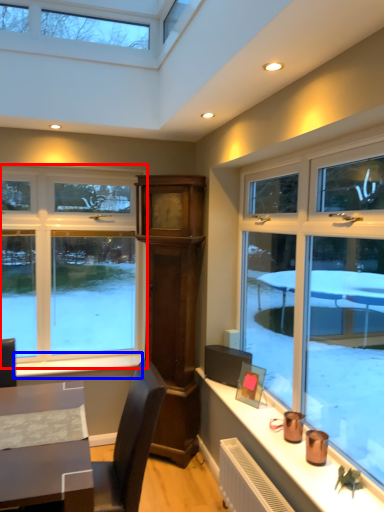
Question: Which object appears farthest to the camera in this image, window (highlighted by a red box) or window sill (highlighted by a blue box)?

Choices:
 (A) window
 (B) window sill

Answer: (A)